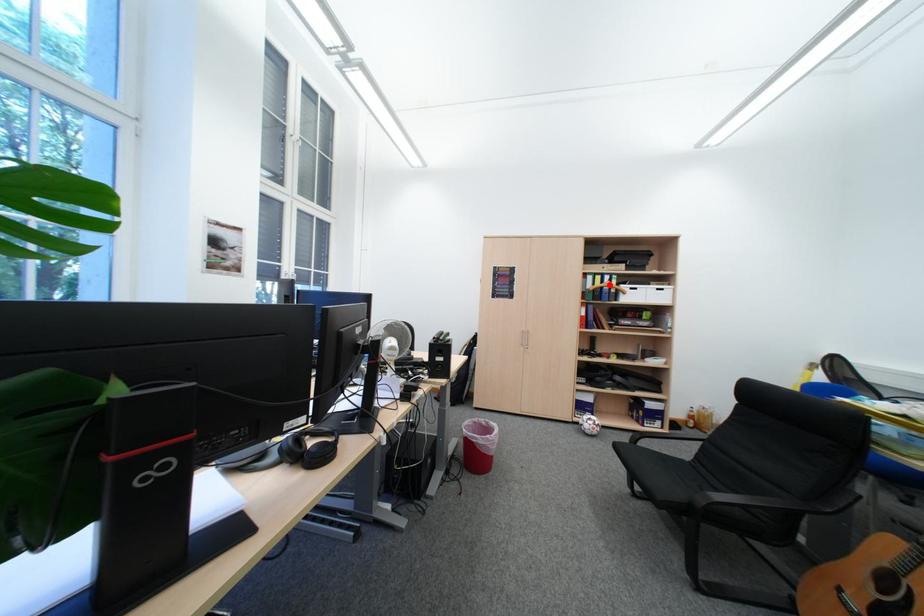
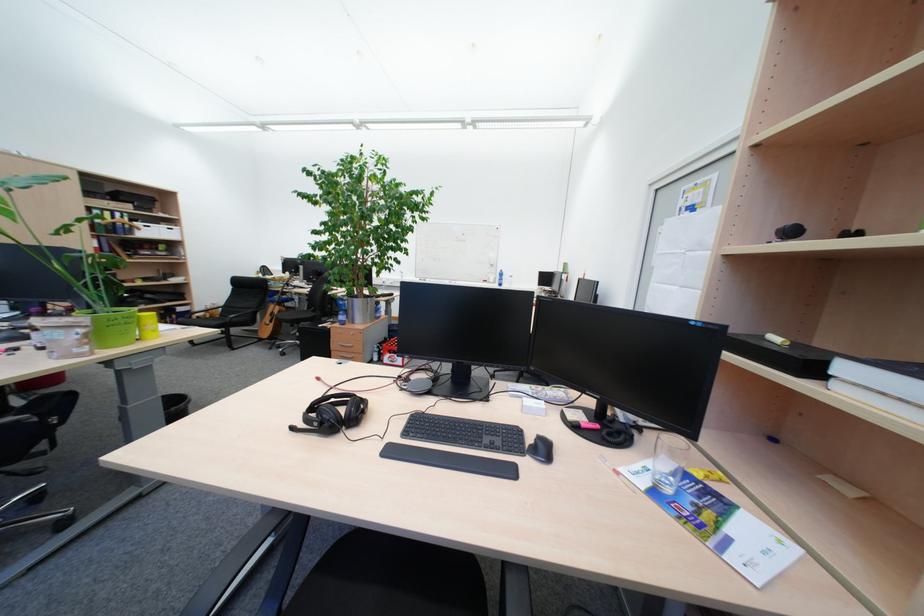
Question: I am providing you with two images of the same scene from different viewpoints. Image1 has a red point marked. In image2, the corresponding 3D location appears at what relative position? Reply with the corresponding letter.

Choices:
 (A) Closer
 (B) Farther

Answer: (B)